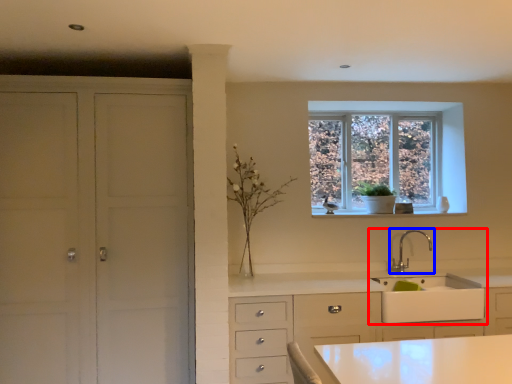
Question: Which object appears closest to the camera in this image, sink (highlighted by a red box) or tap (highlighted by a blue box)?

Choices:
 (A) sink
 (B) tap

Answer: (A)